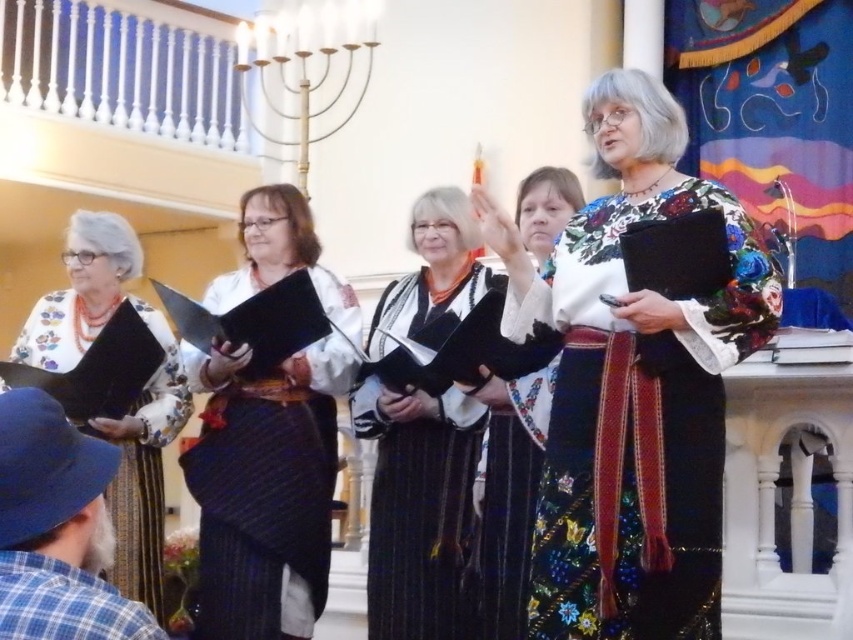
Is black paper at center wider than blue plaid shirt at lower left?

Yes.

In the scene shown: Can you confirm if black paper at center is smaller than blue plaid shirt at lower left?

No.

You are a GUI agent. You are given a task and a screenshot of the screen. Output one action in this format:
    pyautogui.click(x=<x>, y=<y>)
    Task: Click on the black paper at center
    
    Given the screenshot: What is the action you would take?
    pyautogui.click(x=264, y=486)

Which is more to the right, floral-patterned fabric dress at center or matte black book at lower left?

floral-patterned fabric dress at center

Is point (527, 291) positioned before point (47, 348)?

Yes, point (527, 291) is closer to viewer.

Is point (549, 285) positioned before point (91, 301)?

Yes.

This screenshot has width=853, height=640. I want to click on floral-patterned fabric dress at center, so click(x=633, y=387).

Does black velvet robe at center have a greater height compared to blue plaid shirt at lower left?

Yes.

At what (x,y) coordinates should I click in order to perform the action: click on black velvet robe at center. Please return your answer as a coordinate pair (x, y). This screenshot has width=853, height=640. Looking at the image, I should click on (508, 497).

The width and height of the screenshot is (853, 640). I want to click on black velvet robe at center, so click(x=508, y=497).